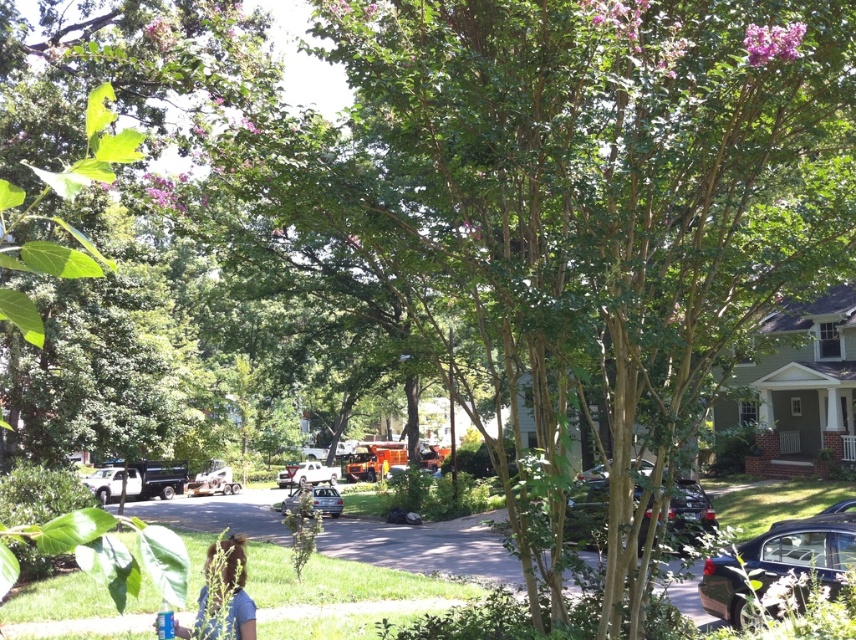
You are a pedestrian standing on the sidewalk and see both the white matte car at center and the metallic silver sedan at center. Which car is closer to you?

The white matte car at center is closer to you because it is positioned further to the viewer than the metallic silver sedan at center.

You are a delivery driver needing to park your 5.5 meter long van between the metallic silver truck at center and the metallic silver sedan at center. Based on the scene, can your van fit in the space between them?

The metallic silver truck at center is 7.48 meters from the metallic silver sedan at center. Since your van is 5.5 meters long, there is sufficient space to park between them as the distance between the two vehicles is greater than the van length.

You are a delivery driver who needs to park your 2.5 meter wide truck in this suburban neighborhood. You see the metallic silver truck at center and the metallic silver sedan at center. Which vehicle has enough space to park without overlapping other cars?

The metallic silver sedan at center has a greater width than the metallic silver truck at center, so it can accommodate your 2.5 meter wide truck without overlapping other cars.